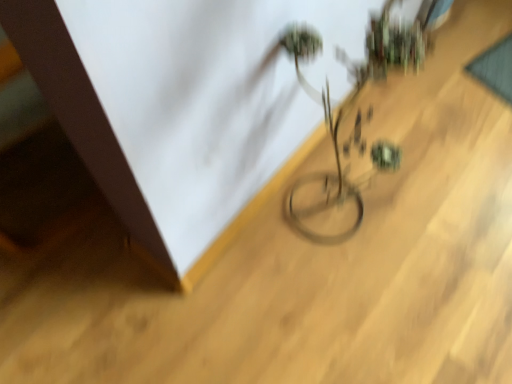
You are a GUI agent. You are given a task and a screenshot of the screen. Output one action in this format:
    pyautogui.click(x=<x>, y=<y>)
    Task: Click on the free location in front of green matte houseplant at center
    This screenshot has width=512, height=384.
    Given the screenshot: What is the action you would take?
    pyautogui.click(x=323, y=302)